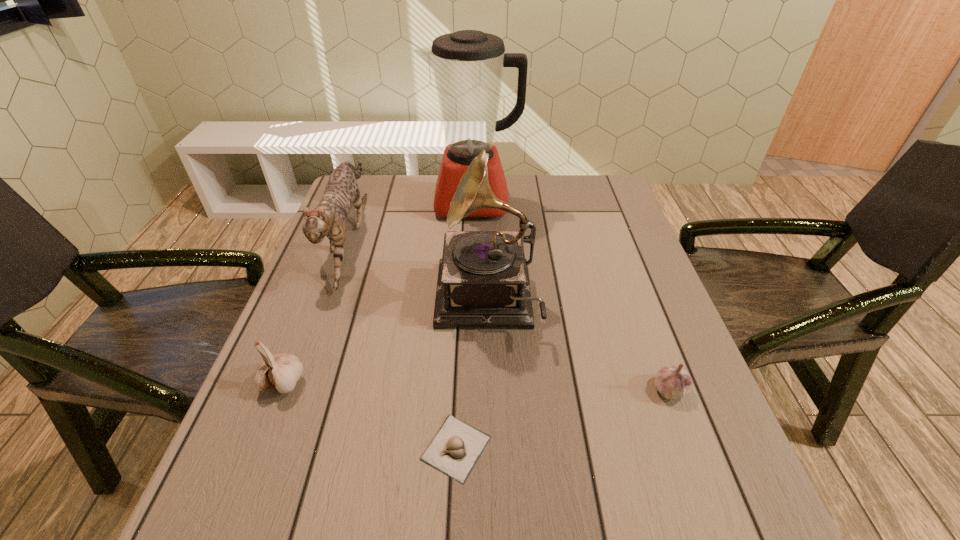
Find the location of a particular element. The image size is (960, 540). garlic that can be found as the second closest to the tallest garlic is located at coordinates (673, 382).

This screenshot has height=540, width=960. I want to click on the closest garlic to the shortest object, so click(281, 371).

Locate an element on the screen. Image resolution: width=960 pixels, height=540 pixels. vacant space that satisfies the following two spatial constraints: 1. on the face of the nearest garlic; 2. on the right side of the cat is located at coordinates (270, 448).

Where is `free point that satisfies the following two spatial constraints: 1. on the horn of the rightmost garlic; 2. on the left side of the record player`? This screenshot has width=960, height=540. free point that satisfies the following two spatial constraints: 1. on the horn of the rightmost garlic; 2. on the left side of the record player is located at coordinates (488, 389).

Find the location of `vacant space that satisfies the following two spatial constraints: 1. on the front side of the tallest garlic; 2. on the right side of the second garlic from left to right`. vacant space that satisfies the following two spatial constraints: 1. on the front side of the tallest garlic; 2. on the right side of the second garlic from left to right is located at coordinates (257, 448).

You are a GUI agent. You are given a task and a screenshot of the screen. Output one action in this format:
    pyautogui.click(x=<x>, y=<y>)
    Task: Click on the vacant space that satisfies the following two spatial constraints: 1. on the face of the cat; 2. on the left side of the shortest garlic
    The width and height of the screenshot is (960, 540).
    Given the screenshot: What is the action you would take?
    pyautogui.click(x=270, y=448)